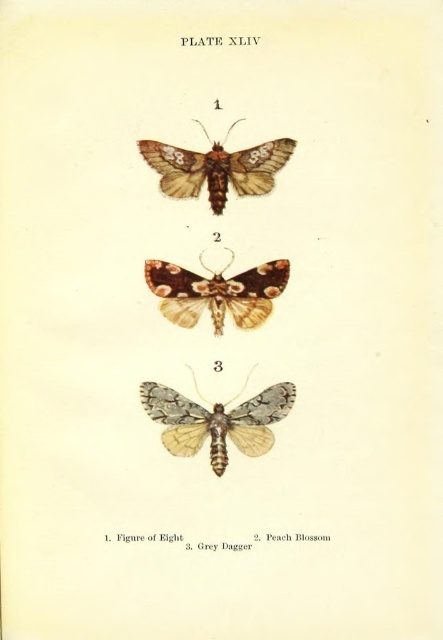
You are looking at a page from a natural history book. There are two moths on the page, a speckled gray moth at center and a brown speckled moth at center. Which one is positioned to the left?

The speckled gray moth at center is positioned to the left of the brown speckled moth at center.

You are a researcher examining the plate and need to locate the brown speckled moth at center. What are its coordinates on the page?

The brown speckled moth at center is located at coordinates point (217, 292).

You are examining the natural history book page and notice two moths labeled as brown speckled moth at center and brown textured moth at upper center. Which one appears to be closer to you?

The brown speckled moth at center is closer because the brown textured moth at upper center is positioned behind it.